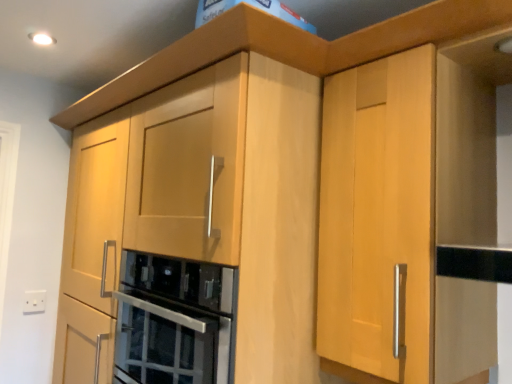
Question: Is white plastic electric outlet at lower left taller or shorter than stainless steel oven at center?

Choices:
 (A) short
 (B) tall

Answer: (A)

Question: Considering the positions of white plastic electric outlet at lower left and stainless steel oven at center in the image, is white plastic electric outlet at lower left wider or thinner than stainless steel oven at center?

Choices:
 (A) thin
 (B) wide

Answer: (A)

Question: Would you say white plastic electric outlet at lower left is to the left or to the right of stainless steel oven at center in the picture?

Choices:
 (A) right
 (B) left

Answer: (B)

Question: In terms of height, does stainless steel oven at center look taller or shorter compared to white plastic electric outlet at lower left?

Choices:
 (A) short
 (B) tall

Answer: (B)

Question: Considering the positions of stainless steel oven at center and white plastic electric outlet at lower left in the image, is stainless steel oven at center wider or thinner than white plastic electric outlet at lower left?

Choices:
 (A) wide
 (B) thin

Answer: (A)

Question: Based on their sizes in the image, would you say stainless steel oven at center is bigger or smaller than white plastic electric outlet at lower left?

Choices:
 (A) big
 (B) small

Answer: (A)

Question: From a real-world perspective, is stainless steel oven at center physically located above or below white plastic electric outlet at lower left?

Choices:
 (A) above
 (B) below

Answer: (A)